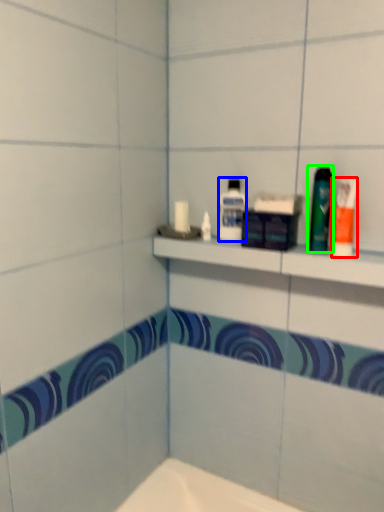
Question: Estimate the real-world distances between objects in this image. Which object is farther from toiletry (highlighted by a red box), mouthwash (highlighted by a blue box) or mouthwash (highlighted by a green box)?

Choices:
 (A) mouthwash
 (B) mouthwash

Answer: (A)